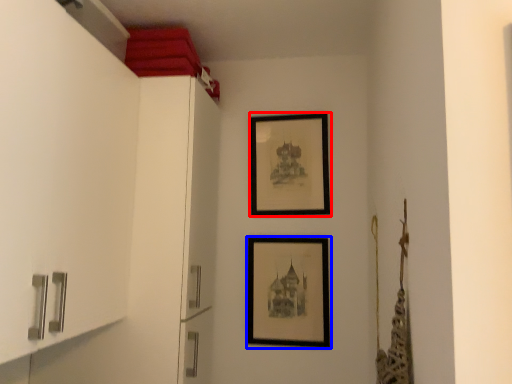
Question: Which point is further to the camera, picture frame (highlighted by a red box) or picture frame (highlighted by a blue box)?

Choices:
 (A) picture frame
 (B) picture frame

Answer: (A)